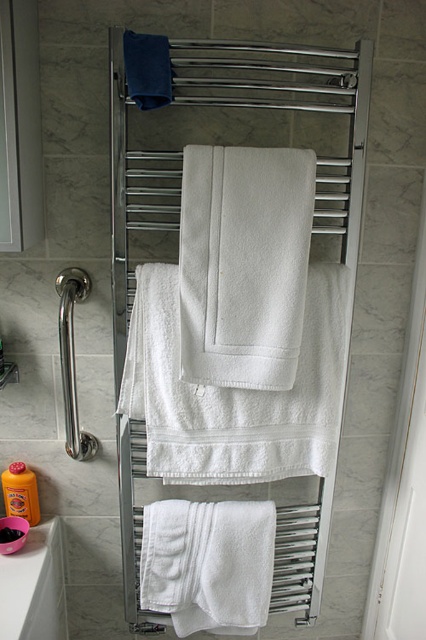
Question: Among these objects, which one is nearest to the camera?

Choices:
 (A) white soft towel at lower center
 (B) white cotton towel at center

Answer: (B)

Question: Among these objects, which one is farthest from the camera?

Choices:
 (A) orange liquid soap at lower left
 (B) white cotton towel at center
 (C) chrome metallic grab bar at left
 (D) white ceramic sink at lower left

Answer: (A)

Question: Can you confirm if white ceramic sink at lower left is wider than orange liquid soap at lower left?

Choices:
 (A) no
 (B) yes

Answer: (B)

Question: Can you confirm if white ceramic sink at lower left is smaller than orange liquid soap at lower left?

Choices:
 (A) yes
 (B) no

Answer: (B)

Question: Estimate the real-world distances between objects in this image. Which object is closer to the white soft towel at center?

Choices:
 (A) white soft towel at lower center
 (B) white cotton towel at center
 (C) white ceramic sink at lower left
 (D) chrome metallic grab bar at left

Answer: (B)

Question: Does white cotton towel at center lie behind white ceramic sink at lower left?

Choices:
 (A) yes
 (B) no

Answer: (A)